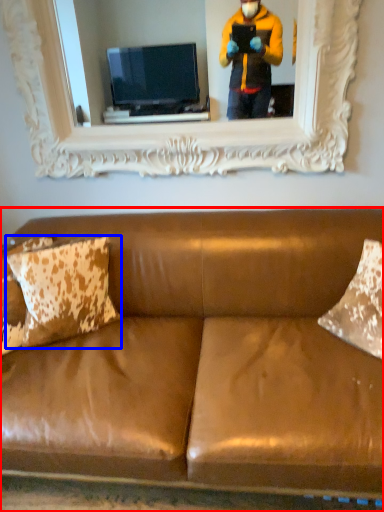
Question: Which point is further to the camera, studio couch (highlighted by a red box) or pillow (highlighted by a blue box)?

Choices:
 (A) studio couch
 (B) pillow

Answer: (B)